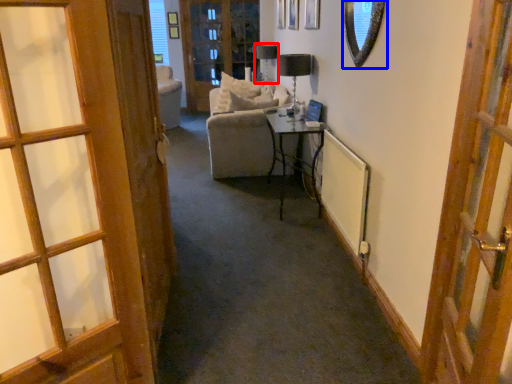
Question: Which of the following is the farthest to the observer, table lamp (highlighted by a red box) or mirror (highlighted by a blue box)?

Choices:
 (A) table lamp
 (B) mirror

Answer: (A)